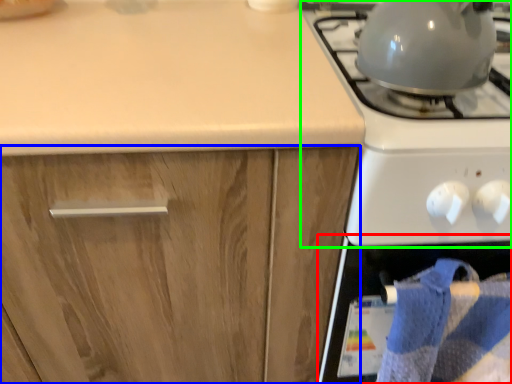
Question: Considering the real-world distances, which object is closest to oven (highlighted by a red box)? cabinetry (highlighted by a blue box) or gas stove (highlighted by a green box).

Choices:
 (A) cabinetry
 (B) gas stove

Answer: (B)